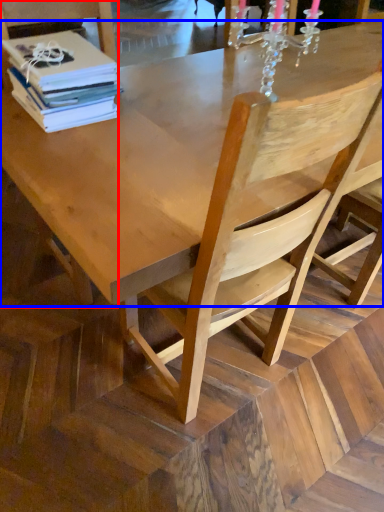
Question: Which of the following is the closest to the observer, chair (highlighted by a red box) or round table (highlighted by a blue box)?

Choices:
 (A) chair
 (B) round table

Answer: (B)